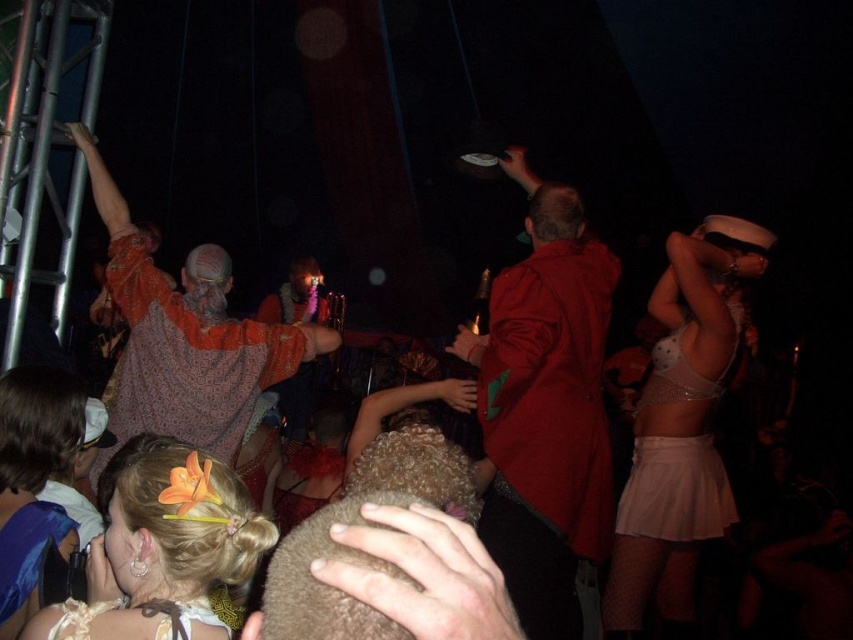
The width and height of the screenshot is (853, 640). Describe the element at coordinates (682, 426) in the screenshot. I see `white mesh skirt at upper right` at that location.

Describe the element at coordinates (682, 426) in the screenshot. I see `white mesh skirt at upper right` at that location.

I want to click on white mesh skirt at upper right, so click(x=682, y=426).

Find the location of `white mesh skirt at upper right`. white mesh skirt at upper right is located at coordinates (682, 426).

Based on the photo, does white mesh skirt at upper right lie behind blonde hair with flower at center?

Yes, it is.

Locate an element on the screen. The width and height of the screenshot is (853, 640). white mesh skirt at upper right is located at coordinates (682, 426).

The height and width of the screenshot is (640, 853). I want to click on white mesh skirt at upper right, so coord(682,426).

Is point (511, 385) positioned before point (138, 592)?

That is False.

Locate an element on the screen. matte red jacket at center is located at coordinates (544, 408).